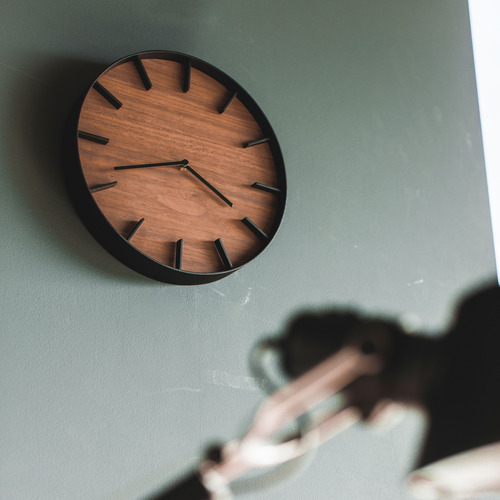
This screenshot has width=500, height=500. I want to click on minute hand on clock, so click(209, 189).